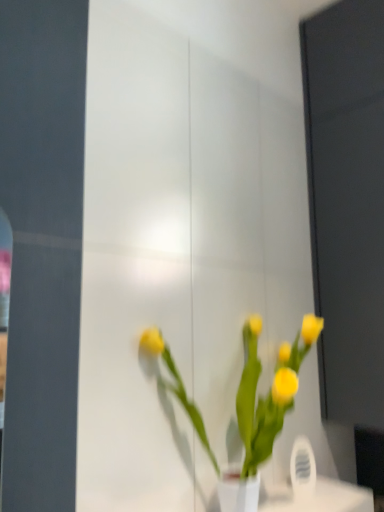
This screenshot has height=512, width=384. What do you see at coordinates (243, 405) in the screenshot?
I see `yellow matte vase at center` at bounding box center [243, 405].

The height and width of the screenshot is (512, 384). What are the coordinates of `yellow matte vase at center` in the screenshot? It's located at (243, 405).

Where is `yellow matte vase at center`? The height and width of the screenshot is (512, 384). yellow matte vase at center is located at coordinates (243, 405).